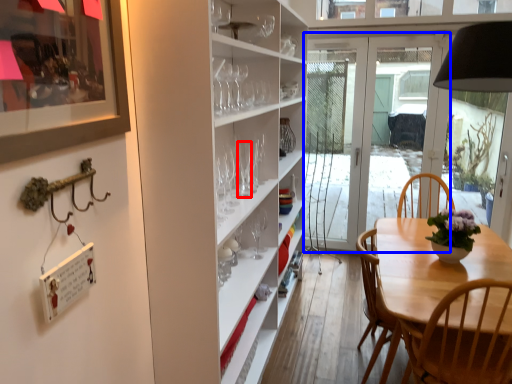
Question: Among these objects, which one is nearest to the camera, wine glass (highlighted by a red box) or door (highlighted by a blue box)?

Choices:
 (A) wine glass
 (B) door

Answer: (A)